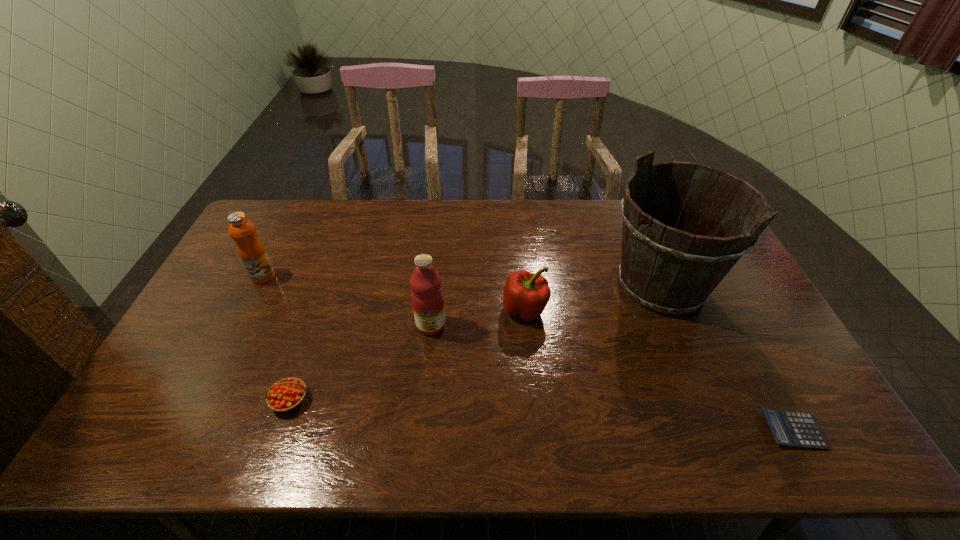
The height and width of the screenshot is (540, 960). I want to click on free space that is in between the shortest object and the fifth tallest object, so click(541, 415).

In order to click on vacant area between the fifth tallest object and the tallest object in this screenshot , I will do `click(475, 343)`.

Where is `free space between the fourth tallest object and the nearer fruit juice`? free space between the fourth tallest object and the nearer fruit juice is located at coordinates (478, 318).

The image size is (960, 540). Identify the location of free spot between the farther fruit juice and the nearer fruit juice. (348, 301).

You are a GUI agent. You are given a task and a screenshot of the screen. Output one action in this format:
    pyautogui.click(x=<x>, y=<y>)
    Task: Click on the vacant point located between the third shortest object and the leftmost object
    The image size is (960, 540).
    Given the screenshot: What is the action you would take?
    pyautogui.click(x=395, y=293)

The image size is (960, 540). What are the coordinates of `the fifth closest object to the nearer fruit juice` in the screenshot? It's located at (790, 428).

Select which object is the fourth closest to the left fruit juice. Please provide its 2D coordinates. Your answer should be formatted as a tuple, i.e. [(x, y)], where the tuple contains the x and y coordinates of a point satisfying the conditions above.

[(668, 266)]

Locate an element on the screen. vacant point that satisfies the following two spatial constraints: 1. on the front side of the fourth object from left to right; 2. on the left side of the farther fruit juice is located at coordinates (247, 309).

At what (x,y) coordinates should I click in order to perform the action: click on vacant space that satisfies the following two spatial constraints: 1. on the front side of the calculator; 2. on the right side of the strawberry. Please return your answer as a coordinate pair (x, y). Looking at the image, I should click on (279, 430).